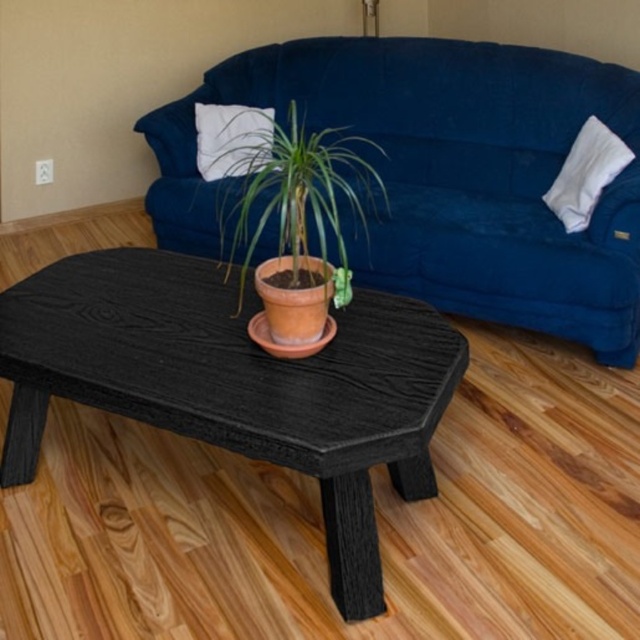
You are a delivery person who needs to place a small package on the coffee table between the velvet blue couch at center and the terracotta clay pot at center. Can you fit the package there if it measures 12 inches in length?

The distance between the velvet blue couch at center and the terracotta clay pot at center is 15.33 inches. Since the package is 12 inches long, it will fit comfortably between them with some space to spare.

You are standing in the room and want to place a new lamp on the coffee table. The lamp requires a specific placement at point (292, 188). Is there an object already occupying that point?

The terracotta clay pot at center is located at point (292, 188), so yes, the spot is occupied by the terracotta clay pot at center.